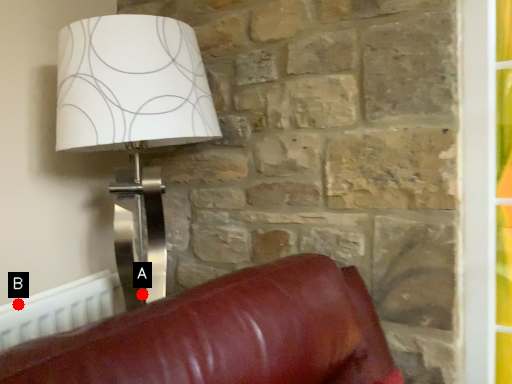
Question: Two points are circled on the image, labeled by A and B beside each circle. Which point is farther from the camera taking this photo?

Choices:
 (A) A is further
 (B) B is further

Answer: (A)